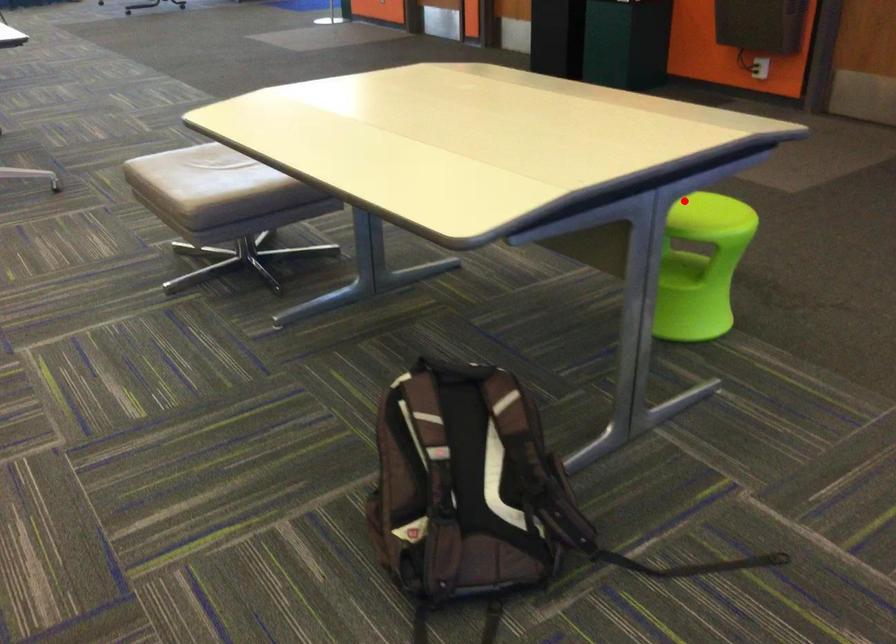
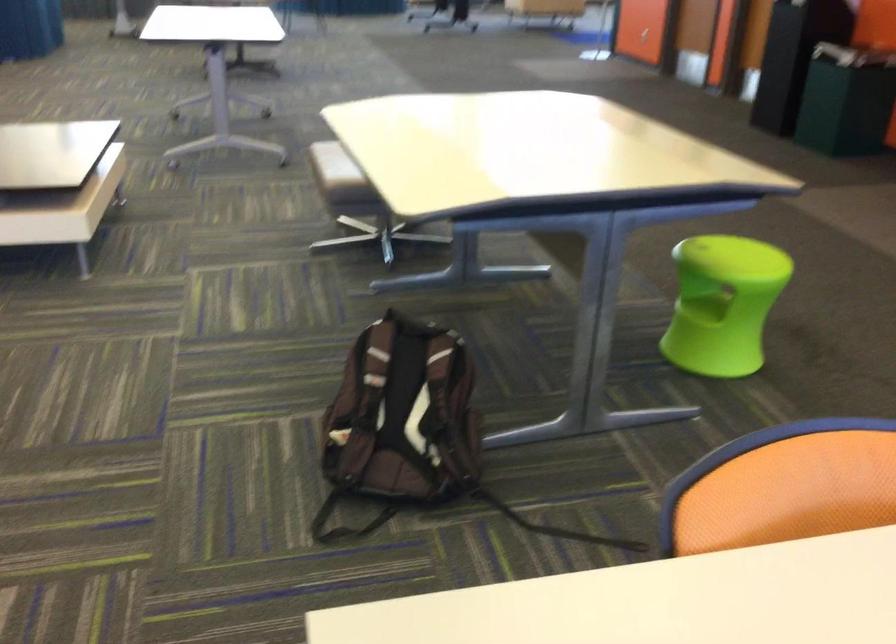
In the second image, find the point that corresponds to the highlighted location in the first image.

(730, 247)